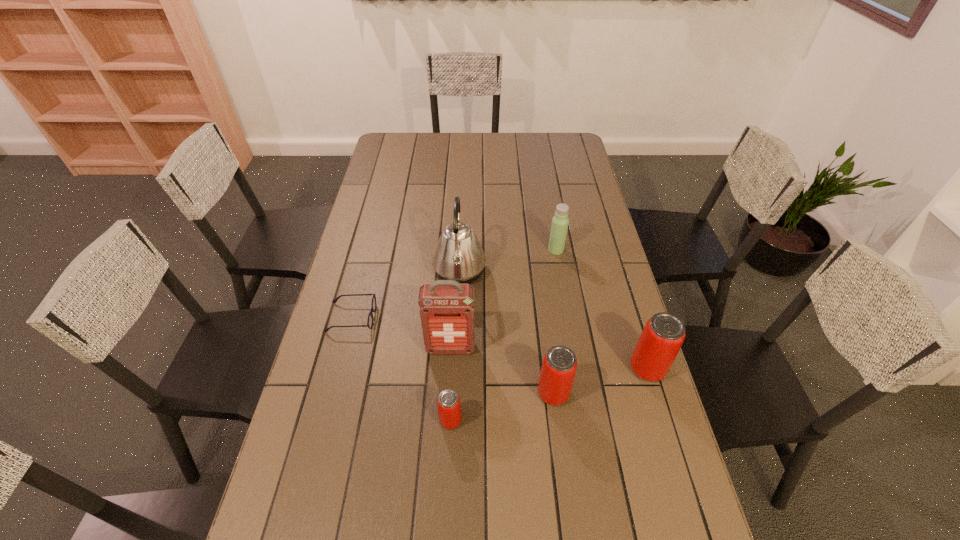
I want to click on vacant area that lies between the rightmost beer can and the kettle, so click(x=553, y=320).

Locate an element on the screen. This screenshot has height=540, width=960. free space between the kettle and the second beer can from left to right is located at coordinates (506, 333).

Find the location of a particular element. The width and height of the screenshot is (960, 540). free space between the thermos bottle and the first-aid kit is located at coordinates (503, 299).

Identify which object is the fifth nearest to the second tallest beer can. Please provide its 2D coordinates. Your answer should be formatted as a tuple, i.e. [(x, y)], where the tuple contains the x and y coordinates of a point satisfying the conditions above.

[(560, 221)]

Identify the location of object that ranks as the fourth closest to the kettle. The width and height of the screenshot is (960, 540). (558, 370).

The image size is (960, 540). I want to click on beer can that stands as the second closest to the thermos bottle, so click(558, 370).

At what (x,y) coordinates should I click in order to perform the action: click on beer can that stands as the second closest to the fifth object from left to right. Please return your answer as a coordinate pair (x, y). Image resolution: width=960 pixels, height=540 pixels. Looking at the image, I should click on (448, 402).

This screenshot has width=960, height=540. What are the coordinates of `free point that satisfies the following two spatial constraints: 1. on the front-facing side of the first-aid kit; 2. on the left side of the third object from right to left` in the screenshot? It's located at (448, 393).

You are a GUI agent. You are given a task and a screenshot of the screen. Output one action in this format:
    pyautogui.click(x=<x>, y=<y>)
    Task: Click on the blank area in the image that satisfies the following two spatial constraints: 1. on the front-facing side of the rightmost object; 2. on the left side of the first-aid kit
    This screenshot has width=960, height=540.
    Given the screenshot: What is the action you would take?
    pyautogui.click(x=449, y=369)

At what (x,y) coordinates should I click in order to perform the action: click on vacant area in the image that satisfies the following two spatial constraints: 1. on the front-facing side of the first-aid kit; 2. on the left side of the rightmost beer can. Please return your answer as a coordinate pair (x, y). This screenshot has width=960, height=540. Looking at the image, I should click on (449, 369).